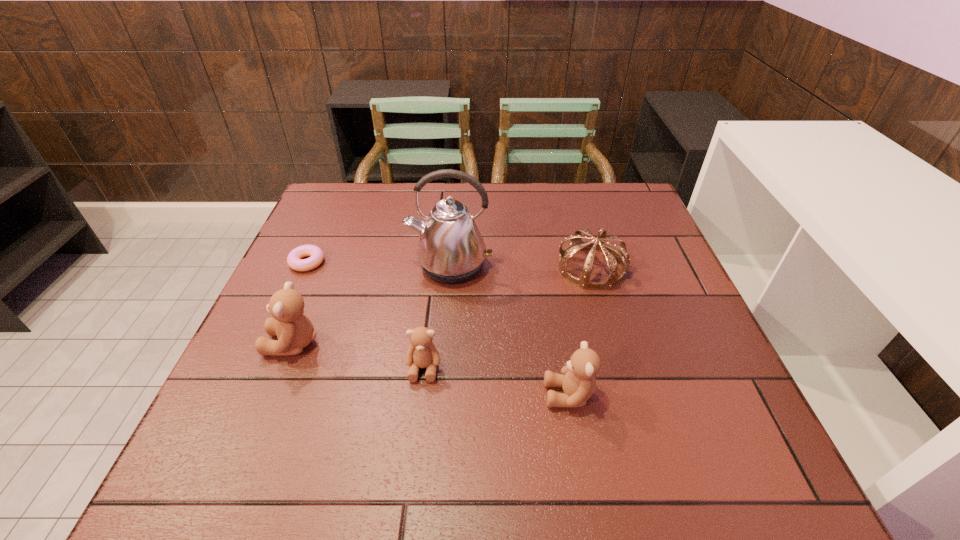
Locate an element on the screen. The width and height of the screenshot is (960, 540). free space between the rightmost teddy bear and the tiara is located at coordinates (580, 331).

You are a GUI agent. You are given a task and a screenshot of the screen. Output one action in this format:
    pyautogui.click(x=<x>, y=<y>)
    Task: Click on the free space between the rightmost teddy bear and the kettle
    This screenshot has width=960, height=540.
    Given the screenshot: What is the action you would take?
    pyautogui.click(x=510, y=330)

Locate an element on the screen. This screenshot has height=540, width=960. free area in between the second shortest teddy bear and the tiara is located at coordinates (580, 331).

Locate which object is the fourth closest to the tallest object. Please provide its 2D coordinates. Your answer should be formatted as a tuple, i.e. [(x, y)], where the tuple contains the x and y coordinates of a point satisfying the conditions above.

[(294, 259)]

Find the location of `the third closest object to the shortest object`. the third closest object to the shortest object is located at coordinates (422, 353).

Where is `teddy bear identified as the closest to the doughnut`? The image size is (960, 540). teddy bear identified as the closest to the doughnut is located at coordinates (294, 330).

Identify which teddy bear is located as the nearest to the kettle. Please provide its 2D coordinates. Your answer should be formatted as a tuple, i.e. [(x, y)], where the tuple contains the x and y coordinates of a point satisfying the conditions above.

[(422, 353)]